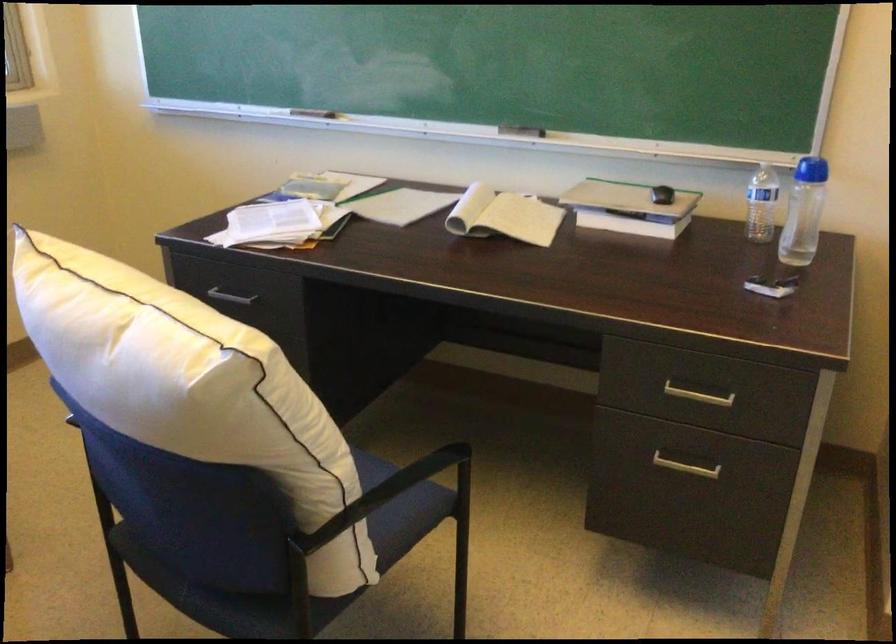
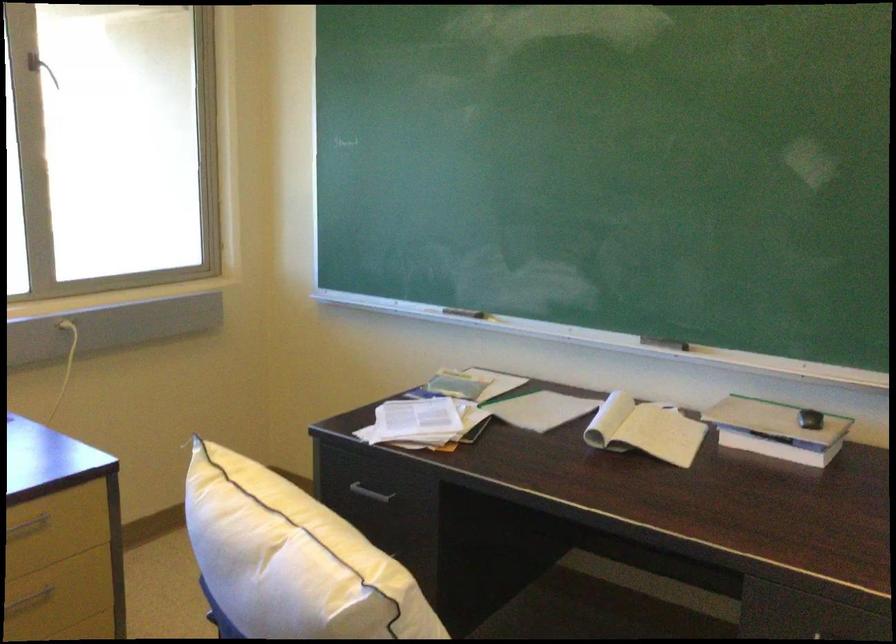
Where in the second image is the point corresponding to [503,220] from the first image?

(644, 430)